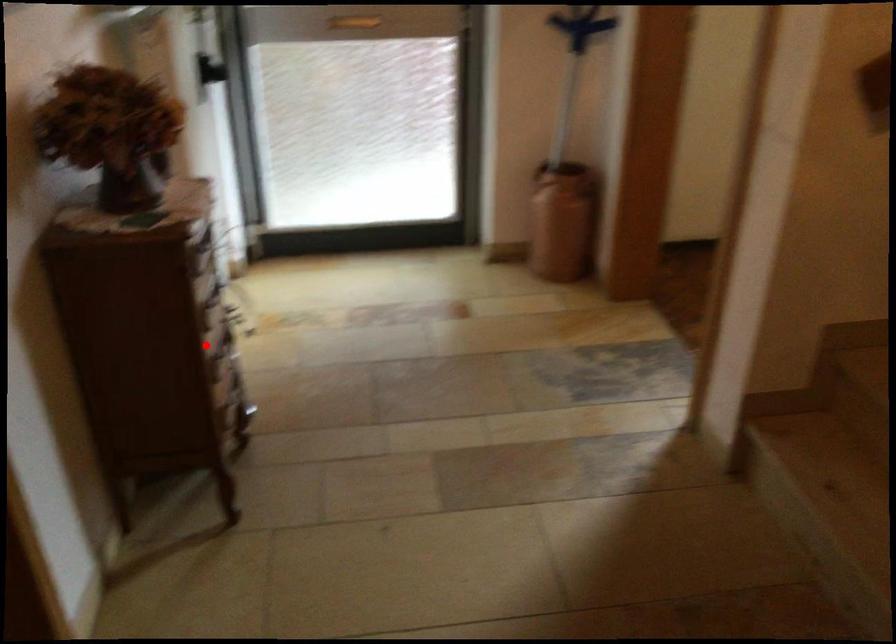
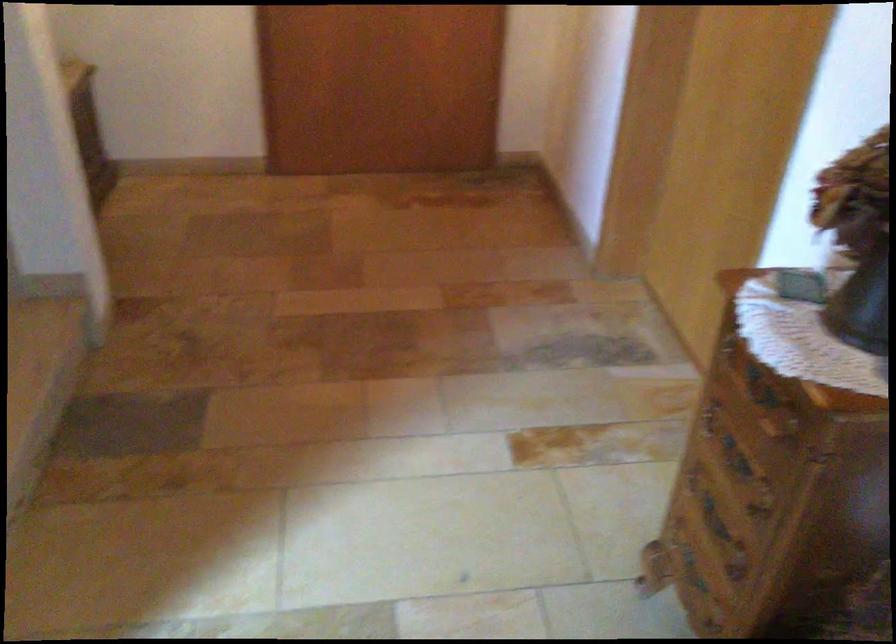
Question: I am providing you with two images of the same scene from different viewpoints. In image1, a red point is highlighted. Considering the same 3D point in image2, which of the following is correct?

Choices:
 (A) It is closer
 (B) It is farther

Answer: (A)